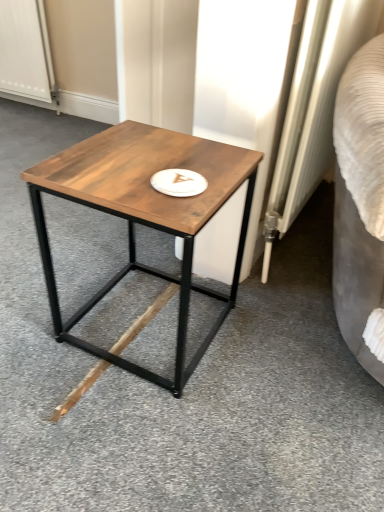
Question: From a real-world perspective, is wooden table at center physically located above or below white textured screen door at upper left?

Choices:
 (A) above
 (B) below

Answer: (B)

Question: Relative to white textured screen door at upper left, is wooden table at center in front or behind?

Choices:
 (A) front
 (B) behind

Answer: (A)

Question: Which is nearer to the white textured screen door at upper left?

Choices:
 (A) wooden table at center
 (B) white textured radiator at right
 (C) white matte platter at center
 (D) brown matte wood at center

Answer: (A)

Question: Which of these objects is positioned closest to the wooden table at center?

Choices:
 (A) white textured radiator at right
 (B) brown matte wood at center
 (C) white textured screen door at upper left
 (D) white matte platter at center

Answer: (D)